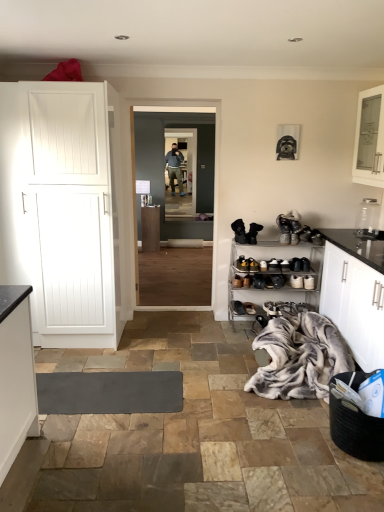
Question: Considering the positions of transparent glass jar at upper right and clear glass door at center, which ranks as the 2th glass door in front-to-back order, in the image, is transparent glass jar at upper right wider or thinner than clear glass door at center, which ranks as the 2th glass door in front-to-back order,?

Choices:
 (A) wide
 (B) thin

Answer: (A)

Question: From the image's perspective, is transparent glass jar at upper right above or below clear glass door at center, which ranks as the 2th glass door in front-to-back order?

Choices:
 (A) above
 (B) below

Answer: (B)

Question: Based on their relative distances, which object is farther from the black leather shoe at lower center, placed as the 2th footwear when sorted from bottom to top?

Choices:
 (A) metallic silver shoe rack at lower right
 (B) brown suede shoe at lower center, the third footwear from the bottom
 (C) transparent glass jar at upper right
 (D) fluffy gray blanket at lower right
 (E) transparent glass door at center, which is the 2th glass door from back to front

Answer: (E)

Question: Which object is positioned closest to the metallic silver shoe rack at lower right?

Choices:
 (A) black leather boots at center, arranged as the fifth footwear when ordered from the bottom
 (B) clear glass door at center, which is counted as the 1th glass door, starting from the back
 (C) black leather shoe at lower center, placed as the 2th footwear when sorted from bottom to top
 (D) fluffy gray blanket at lower right
 (E) white matte cabinet at left

Answer: (C)